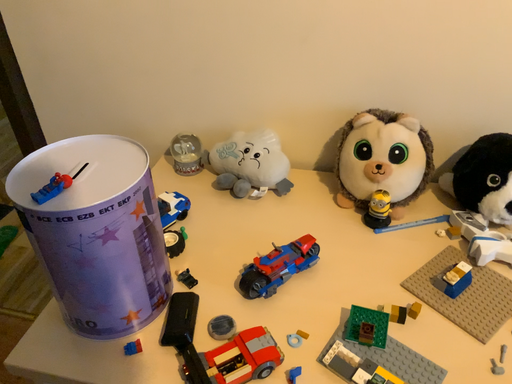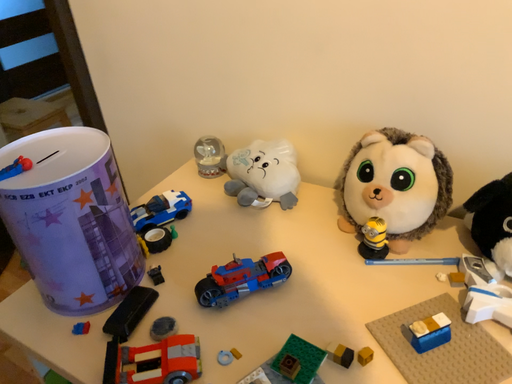
Question: Which way did the camera rotate in the video?

Choices:
 (A) rotated left
 (B) rotated right

Answer: (A)